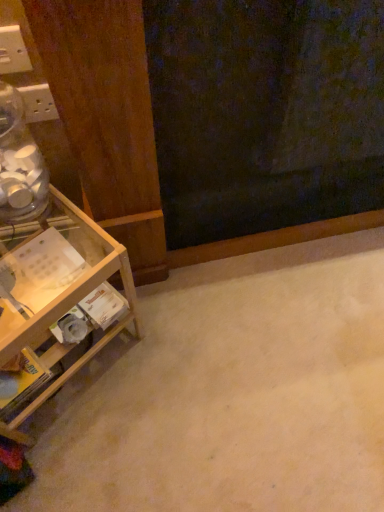
Question: Can you confirm if white plastic electric outlet at upper left, the 1th electric outlet in the front-to-back sequence, is wider than wooden shelf at left?

Choices:
 (A) no
 (B) yes

Answer: (A)

Question: Considering the relative sizes of white plastic electric outlet at upper left, marked as the second electric outlet in a back-to-front arrangement, and wooden shelf at left in the image provided, is white plastic electric outlet at upper left, marked as the second electric outlet in a back-to-front arrangement, smaller than wooden shelf at left?

Choices:
 (A) no
 (B) yes

Answer: (B)

Question: Is white plastic electric outlet at upper left, marked as the second electric outlet in a back-to-front arrangement, positioned beyond the bounds of wooden shelf at left?

Choices:
 (A) no
 (B) yes

Answer: (B)

Question: Does white plastic electric outlet at upper left, marked as the second electric outlet in a back-to-front arrangement, touch wooden shelf at left?

Choices:
 (A) yes
 (B) no

Answer: (B)

Question: Is white plastic electric outlet at upper left, the 1th electric outlet positioned from the top, facing away from wooden shelf at left?

Choices:
 (A) yes
 (B) no

Answer: (B)

Question: Is white plastic electric outlet at upper left, marked as the second electric outlet in a back-to-front arrangement, positioned in front of wooden shelf at left?

Choices:
 (A) yes
 (B) no

Answer: (B)

Question: From the image's perspective, is white plastic electric outlet at upper left, positioned as the first electric outlet in bottom-to-top order, located beneath wooden shelf at left?

Choices:
 (A) no
 (B) yes

Answer: (A)

Question: Is white plastic electric outlet at upper left, the 2th electric outlet when ordered from front to back, with wooden shelf at left?

Choices:
 (A) no
 (B) yes

Answer: (A)

Question: Is wooden shelf at left surrounded by white plastic electric outlet at upper left, the 2th electric outlet when ordered from front to back?

Choices:
 (A) no
 (B) yes

Answer: (A)

Question: Can you confirm if white plastic electric outlet at upper left, the 2th electric outlet when ordered from front to back, is bigger than wooden shelf at left?

Choices:
 (A) no
 (B) yes

Answer: (A)

Question: Does white plastic electric outlet at upper left, acting as the 2th electric outlet starting from the top, come behind wooden shelf at left?

Choices:
 (A) yes
 (B) no

Answer: (A)

Question: Considering the relative positions of white plastic electric outlet at upper left, acting as the 2th electric outlet starting from the top, and wooden shelf at left in the image provided, is white plastic electric outlet at upper left, acting as the 2th electric outlet starting from the top, in front of wooden shelf at left?

Choices:
 (A) no
 (B) yes

Answer: (A)

Question: Can you confirm if white plastic electric outlet at upper left, which ranks as the second electric outlet in bottom-to-top order, is taller than white plastic electric outlet at upper left, the 2th electric outlet when ordered from front to back?

Choices:
 (A) yes
 (B) no

Answer: (A)